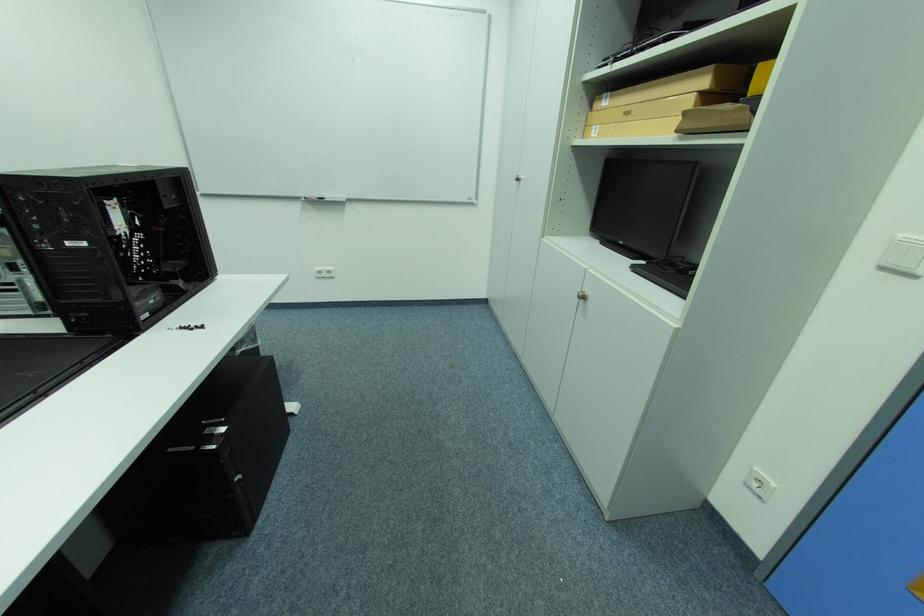
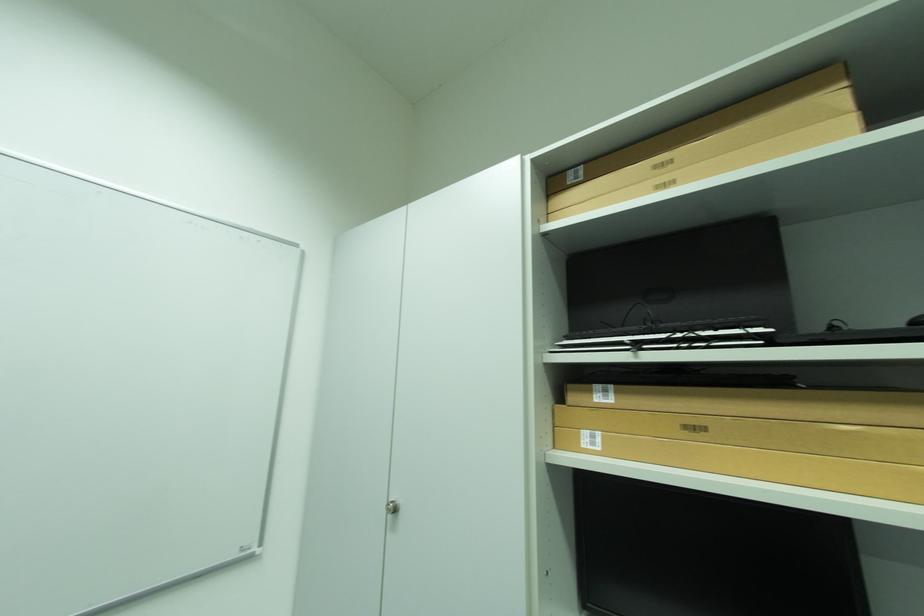
Find the pixel in the second image that matches point 614,98 in the first image.

(614, 392)